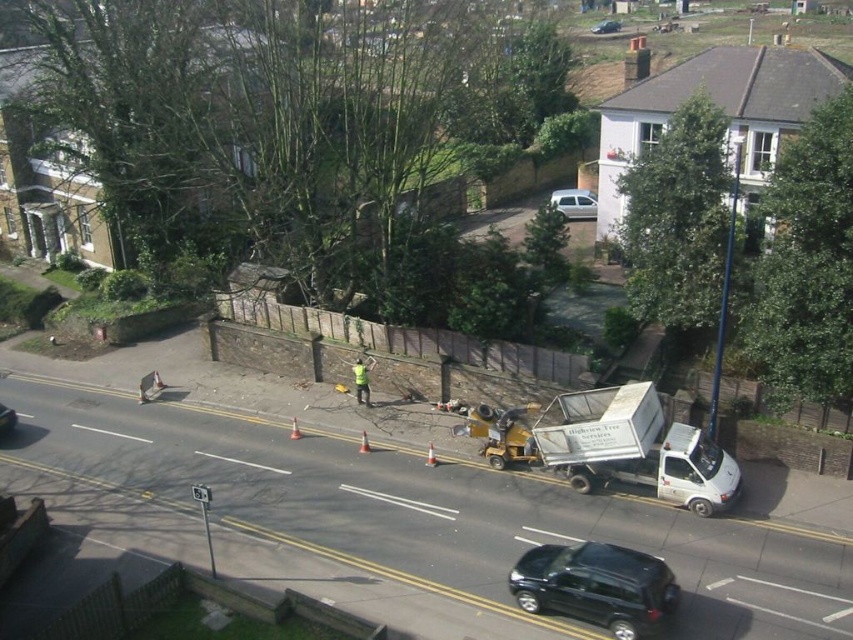
You are driving a car and see the silver metallic hatchback at center in the image. Where would you expect to find this car in the scene?

The silver metallic hatchback at center is located at point coordinates (573,204) in the image.

You are driving a car and see the black glossy car at left and the metallic silver car at center in front of you. Which car should you be cautious of hitting first?

The black glossy car at left is closer to the viewer than the metallic silver car at center, so you should be cautious of hitting the black glossy car at left first.